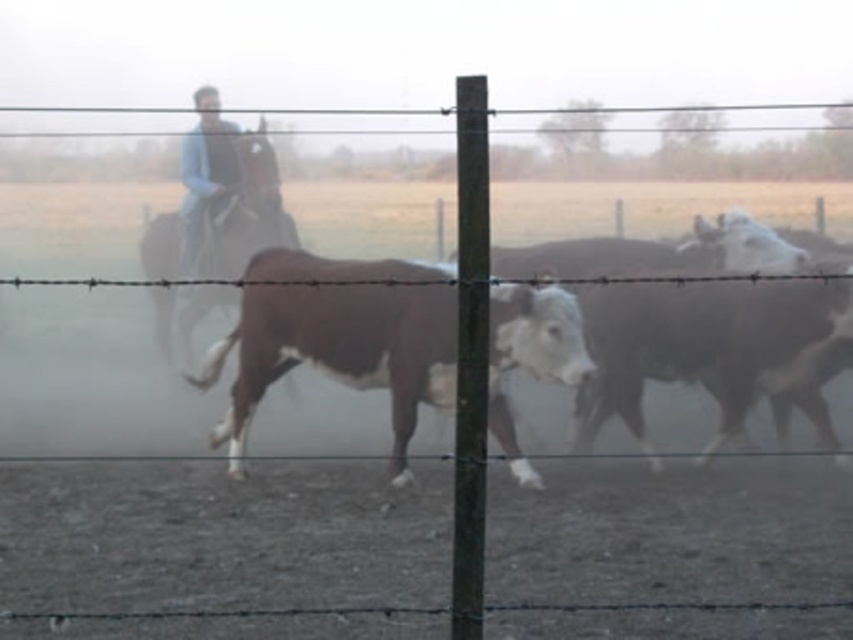
Question: Is brown speckled hide at center closer to the viewer compared to brown glossy horse at left?

Choices:
 (A) no
 (B) yes

Answer: (B)

Question: Which object is the farthest from the brown speckled hide at center?

Choices:
 (A) brown glossy cow at center
 (B) brown glossy horse at left

Answer: (A)

Question: Which of the following is the closest to the observer?

Choices:
 (A) (271, 220)
 (B) (337, 321)
 (C) (775, 308)

Answer: (C)

Question: Is brown speckled hide at center further to camera compared to brown glossy horse at left?

Choices:
 (A) yes
 (B) no

Answer: (B)

Question: Which is nearer to the brown speckled hide at center?

Choices:
 (A) brown glossy cow at center
 (B) brown glossy horse at left

Answer: (B)

Question: Is brown glossy cow at center to the right of brown glossy horse at left from the viewer's perspective?

Choices:
 (A) no
 (B) yes

Answer: (B)